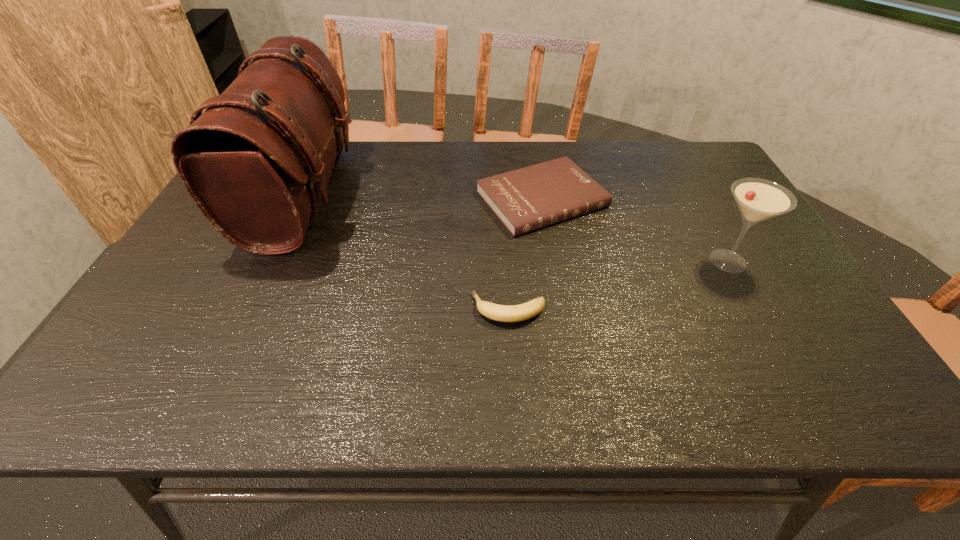
Identify the location of satchel positioned at the far edge. The height and width of the screenshot is (540, 960). (256, 161).

Locate an element on the screen. The height and width of the screenshot is (540, 960). hardback book present at the far edge is located at coordinates (526, 199).

I want to click on object situated at the left edge, so click(256, 161).

Locate an element on the screen. This screenshot has height=540, width=960. object located at the right edge is located at coordinates (758, 199).

Locate an element on the screen. This screenshot has width=960, height=540. object present at the far left corner is located at coordinates (256, 161).

Where is `free space at the far edge of the desktop`? The image size is (960, 540). free space at the far edge of the desktop is located at coordinates (588, 165).

Locate an element on the screen. free space at the near edge is located at coordinates (708, 377).

Identify the location of blank space at the left edge of the desktop. Image resolution: width=960 pixels, height=540 pixels. (201, 320).

The image size is (960, 540). In order to click on vacant space at the right edge of the desktop in this screenshot , I will do `click(713, 220)`.

Locate an element on the screen. Image resolution: width=960 pixels, height=540 pixels. vacant space at the near left corner of the desktop is located at coordinates (90, 406).